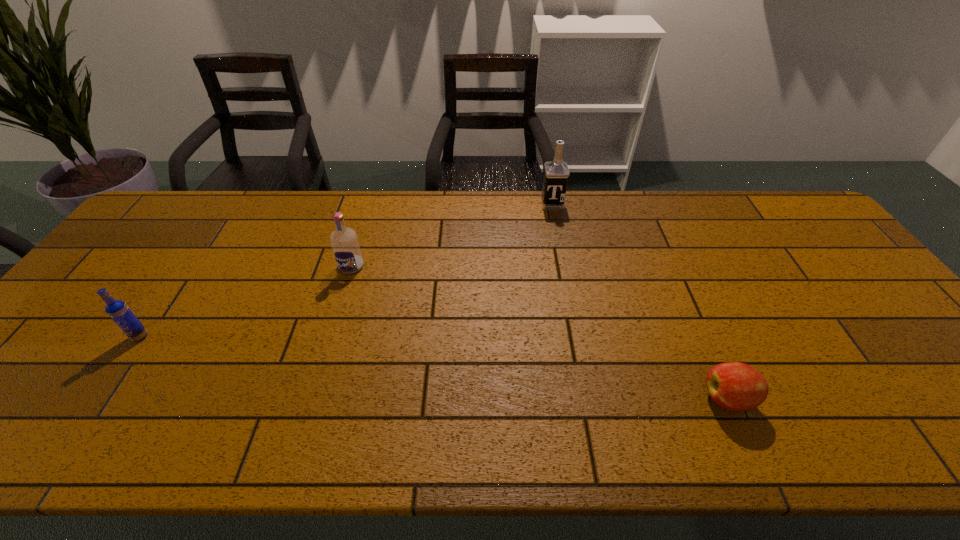
Identify which vodka is located as the nearest to the farthest vodka. Please provide its 2D coordinates. Your answer should be formatted as a tuple, i.e. [(x, y)], where the tuple contains the x and y coordinates of a point satisfying the conditions above.

[(344, 241)]

I want to click on vacant point that satisfies the following two spatial constraints: 1. on the front label of the farthest object; 2. on the left side of the shortest object, so click(590, 399).

This screenshot has width=960, height=540. I want to click on free spot that satisfies the following two spatial constraints: 1. on the front label of the nearest object; 2. on the right side of the rightmost vodka, so click(590, 399).